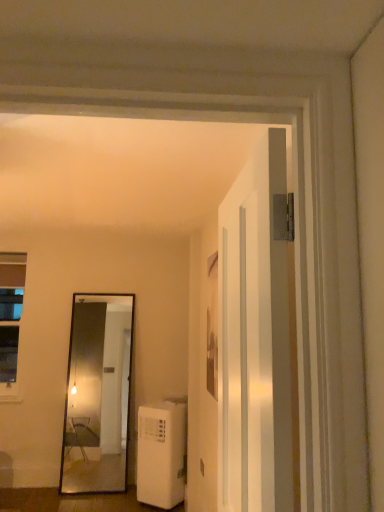
Question: From a real-world perspective, is clear glass window at left positioned above or below white plastic air conditioner at lower left?

Choices:
 (A) above
 (B) below

Answer: (A)

Question: From the image's perspective, relative to white plastic air conditioner at lower left, is clear glass window at left above or below?

Choices:
 (A) above
 (B) below

Answer: (A)

Question: Which is nearer to the white glossy door at center?

Choices:
 (A) clear glass window at left
 (B) white plastic air conditioner at lower left

Answer: (B)

Question: Estimate the real-world distances between objects in this image. Which object is closer to the white glossy door at center?

Choices:
 (A) clear glass window at left
 (B) white plastic air conditioner at lower left

Answer: (B)